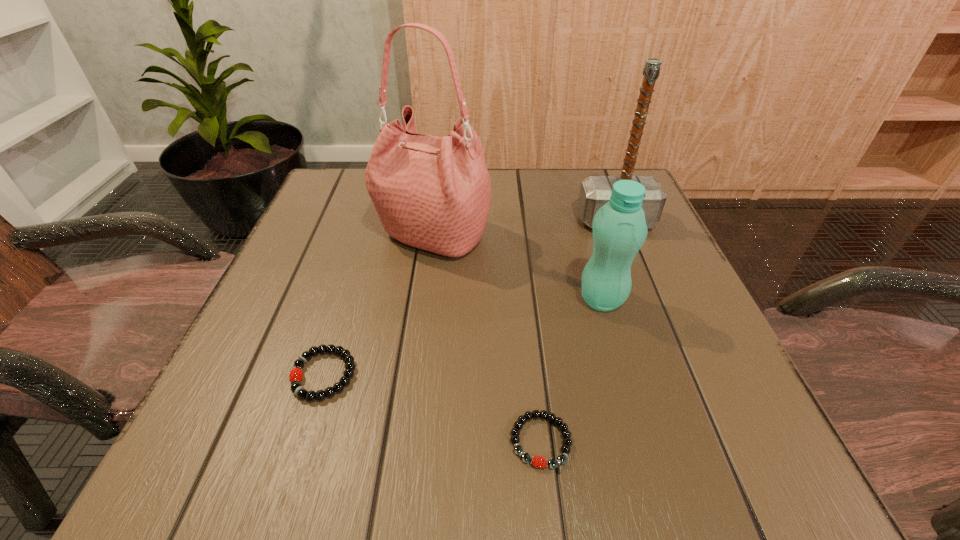
The width and height of the screenshot is (960, 540). In order to click on vacant area at the far edge in this screenshot , I will do `click(549, 211)`.

This screenshot has height=540, width=960. In order to click on vacant space at the near edge of the desktop in this screenshot , I will do `click(560, 434)`.

In the image, there is a desktop. Where is `vacant space at the left edge`? vacant space at the left edge is located at coordinates (208, 416).

At what (x,y) coordinates should I click in order to perform the action: click on free space at the right edge of the desktop. Please return your answer as a coordinate pair (x, y). Image resolution: width=960 pixels, height=540 pixels. Looking at the image, I should click on (593, 242).

Where is `vacant space at the near left corner`? The image size is (960, 540). vacant space at the near left corner is located at coordinates (259, 472).

I want to click on free space between the hammer and the nearest object, so click(578, 331).

What are the coordinates of `free space between the hammer and the third object from right to left` in the screenshot? It's located at (578, 331).

Where is `vacant point located between the third object from right to left and the taller bracelet`? vacant point located between the third object from right to left and the taller bracelet is located at coordinates (432, 408).

The height and width of the screenshot is (540, 960). I want to click on vacant area that lies between the hammer and the tallest object, so click(524, 228).

This screenshot has height=540, width=960. I want to click on unoccupied area between the nearest object and the third shortest object, so click(571, 370).